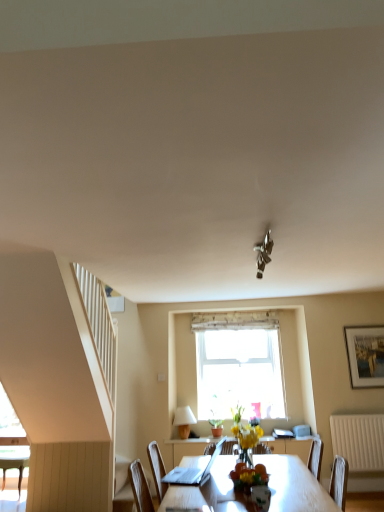
Find the location of `silver metallic picture frame at upper right`. silver metallic picture frame at upper right is located at coordinates (365, 355).

What do you see at coordinates (359, 441) in the screenshot? The image size is (384, 512). I see `white textured radiator at lower right` at bounding box center [359, 441].

What do you see at coordinates (294, 486) in the screenshot?
I see `wooden table at center` at bounding box center [294, 486].

Identify the location of metallic chrome light fixture at center. (263, 254).

How different are the orientations of clear glass window at center and wooden table at center in degrees?

The angle between the facing direction of clear glass window at center and the facing direction of wooden table at center is 90.6 degrees.

Is clear glass window at center positioned behind wooden table at center?

Yes, clear glass window at center is further from the viewer.

In the scene shown: Is clear glass window at center bigger or smaller than wooden table at center?

In the image, clear glass window at center appears to be smaller than wooden table at center.

From a real-world perspective, which is physically below, clear glass window at center or wooden table at center?

wooden table at center is physically lower.

Is silver metallic picture frame at upper right surrounding wooden table at center?

No, wooden table at center is not inside silver metallic picture frame at upper right.

Can you confirm if silver metallic picture frame at upper right is wider than wooden table at center?

No, silver metallic picture frame at upper right is not wider than wooden table at center.

From a real-world perspective, who is located lower, silver metallic picture frame at upper right or wooden table at center?

wooden table at center, from a real-world perspective.

Which is nearer, (268, 316) or (229, 330)?

The point (268, 316) is closer to the camera.

Is wooden/textured curtain at upper center bigger or smaller than clear glass window at center?

Considering their sizes, wooden/textured curtain at upper center takes up less space than clear glass window at center.

Consider the image. Does wooden/textured curtain at upper center turn towards clear glass window at center?

No, wooden/textured curtain at upper center is not aimed at clear glass window at center.

Is wooden/textured curtain at upper center positioned behind clear glass window at center?

Yes, wooden/textured curtain at upper center is further from the viewer.

At what (x,y) coordinates should I click in order to perform the action: click on flower behind the metallic chrome light fixture at center. Please return your answer as a coordinate pair (x, y). Looking at the image, I should click on (247, 435).

Is metallic chrome light fixture at center to the left of yellow matte vase at center from the viewer's perspective?

Incorrect, metallic chrome light fixture at center is not on the left side of yellow matte vase at center.

Which is in front, metallic chrome light fixture at center or yellow matte vase at center?

metallic chrome light fixture at center.

Is metallic chrome light fixture at center looking in the opposite direction of yellow matte vase at center?

metallic chrome light fixture at center is not turned away from yellow matte vase at center.

Would you consider clear glass window at center to be distant from white textured radiator at lower right?

clear glass window at center is far away from white textured radiator at lower right.

Considering the sizes of objects clear glass window at center and white textured radiator at lower right in the image provided, who is smaller, clear glass window at center or white textured radiator at lower right?

Smaller between the two is white textured radiator at lower right.

Considering the sizes of objects clear glass window at center and white textured radiator at lower right in the image provided, who is thinner, clear glass window at center or white textured radiator at lower right?

With smaller width is white textured radiator at lower right.

Who is more distant, wooden table at center or yellow matte vase at center?

yellow matte vase at center is behind.

In terms of height, does wooden table at center look taller or shorter compared to yellow matte vase at center?

wooden table at center is taller than yellow matte vase at center.

Looking at this image, how different are the orientations of wooden table at center and yellow matte vase at center in degrees?

The angular difference between wooden table at center and yellow matte vase at center is 3.97 degrees.

Based on the photo, which object is positioned more to the left, wooden table at center or yellow matte vase at center?

From the viewer's perspective, wooden table at center appears more on the left side.

From the image's perspective, is metallic chrome light fixture at center below silver metallic picture frame at upper right?

No, from the image's perspective, metallic chrome light fixture at center is not beneath silver metallic picture frame at upper right.

Does metallic chrome light fixture at center have a greater height compared to silver metallic picture frame at upper right?

No.

Can you confirm if metallic chrome light fixture at center is positioned to the right of silver metallic picture frame at upper right?

Incorrect, metallic chrome light fixture at center is not on the right side of silver metallic picture frame at upper right.

Does metallic chrome light fixture at center lie behind silver metallic picture frame at upper right?

No.

Find the location of a particular element. Image resolution: width=384 pixels, height=512 pixels. window above the wooden table at center (from the image's perspective) is located at coordinates pyautogui.click(x=239, y=366).

Where is `table below the silver metallic picture frame at upper right (from a real-world perspective)`? This screenshot has height=512, width=384. table below the silver metallic picture frame at upper right (from a real-world perspective) is located at coordinates (294, 486).

Estimate the real-world distances between objects in this image. Which object is closer to metallic chrome light fixture at center, wooden table at center or white textured radiator at lower right?

The object closer to metallic chrome light fixture at center is wooden table at center.

Considering their positions, is silver metallic picture frame at upper right positioned further to white matte lampshade at lower center than white textured radiator at lower right?

The object further to white matte lampshade at lower center is silver metallic picture frame at upper right.

When comparing their distances from wooden table at center, does metallic chrome light fixture at center or silver metallic picture frame at upper right seem closer?

metallic chrome light fixture at center is positioned closer to the anchor wooden table at center.

Estimate the real-world distances between objects in this image. Which object is closer to white matte lampshade at lower center, white textured radiator at lower right or wooden/textured curtain at upper center?

wooden/textured curtain at upper center is closer to white matte lampshade at lower center.

Considering their positions, is metallic chrome light fixture at center positioned further to white matte lampshade at lower center than wooden table at center?

The object further to white matte lampshade at lower center is wooden table at center.

From the picture: From the image, which object appears to be nearer to white matte lampshade at lower center, clear glass window at center or white textured radiator at lower right?

Based on the image, clear glass window at center appears to be nearer to white matte lampshade at lower center.

In the scene shown: From the image, which object appears to be farther from clear glass window at center, wooden/textured curtain at upper center or silver metallic picture frame at upper right?

Based on the image, silver metallic picture frame at upper right appears to be further to clear glass window at center.

Considering their positions, is white textured radiator at lower right positioned closer to clear glass window at center than wooden/textured curtain at upper center?

Based on the image, wooden/textured curtain at upper center appears to be nearer to clear glass window at center.

What are the coordinates of `radiator positioned between metallic chrome light fixture at center and silver metallic picture frame at upper right from near to far` in the screenshot? It's located at (359, 441).

You are a GUI agent. You are given a task and a screenshot of the screen. Output one action in this format:
    pyautogui.click(x=<x>, y=<y>)
    Task: Click on the window situated between white matte lampshade at lower center and white textured radiator at lower right from left to right
    The image size is (384, 512).
    Given the screenshot: What is the action you would take?
    pyautogui.click(x=239, y=366)

I want to click on flower located between wooden table at center and silver metallic picture frame at upper right in the depth direction, so click(247, 435).

Locate an element on the screen. This screenshot has height=512, width=384. flower between metallic chrome light fixture at center and wooden/textured curtain at upper center from front to back is located at coordinates (247, 435).